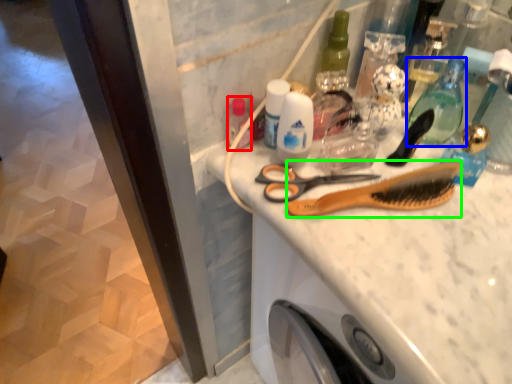
Question: Estimate the real-world distances between objects in this image. Which object is farther from toiletry (highlighted by a red box), mouthwash (highlighted by a blue box) or comb (highlighted by a green box)?

Choices:
 (A) mouthwash
 (B) comb

Answer: (A)